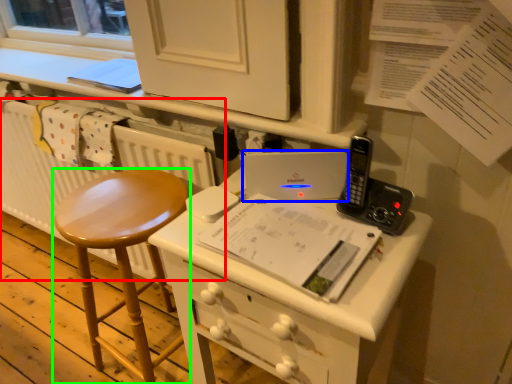
Question: Based on their relative distances, which object is farther from radiator (highlighted by a red box)? Choose from laptop (highlighted by a blue box) and stool (highlighted by a green box).

Choices:
 (A) laptop
 (B) stool

Answer: (A)